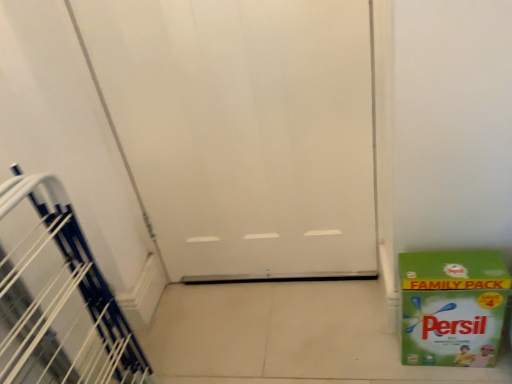
You are a GUI agent. You are given a task and a screenshot of the screen. Output one action in this format:
    pyautogui.click(x=<x>, y=<y>)
    Task: Click on the free space to the left of green paper box at lower right
    
    Given the screenshot: What is the action you would take?
    pyautogui.click(x=372, y=358)